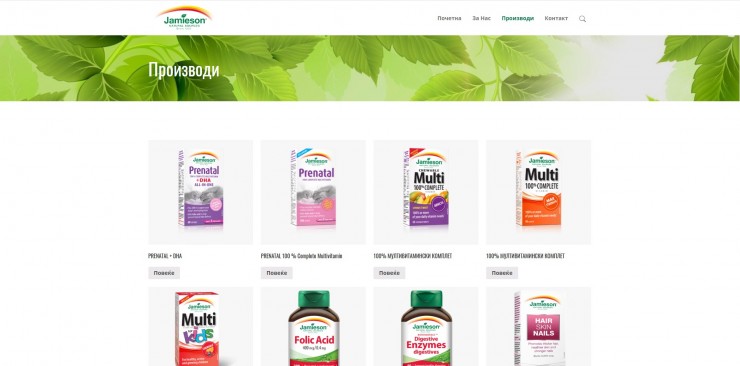
The height and width of the screenshot is (366, 740). In order to click on bottles in this screenshot , I will do `click(314, 339)`, `click(403, 337)`.